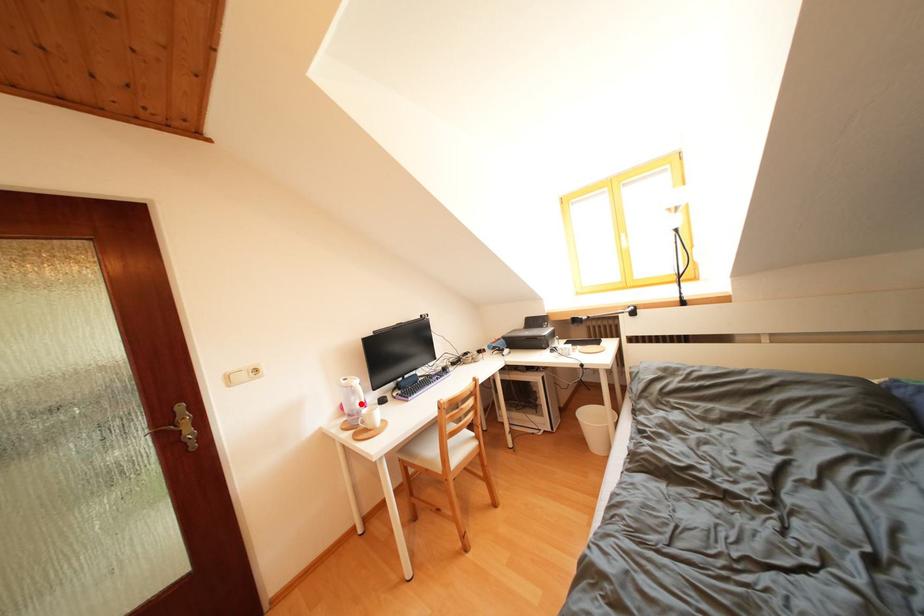
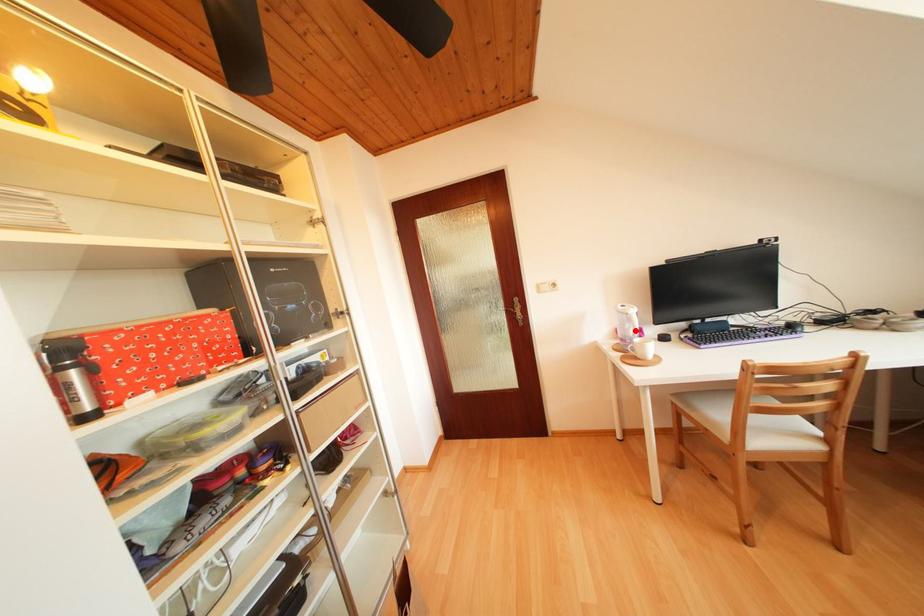
I am providing you with two images of the same scene from different viewpoints. A red point is marked on the first image and another point is marked on the second image. Do the highlighted points in image1 and image2 indicate the same real-world spot?

Yes